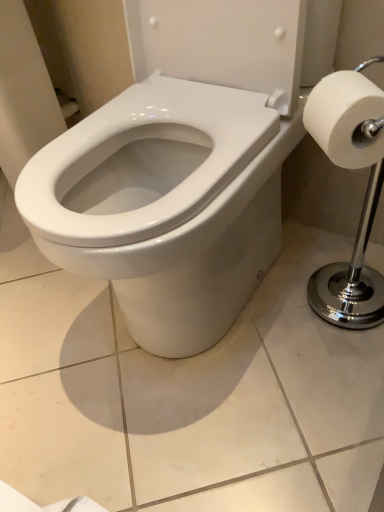
Question: From a real-world perspective, is white matte toilet paper at right physically below white glossy bidet at center?

Choices:
 (A) no
 (B) yes

Answer: (A)

Question: Is white matte toilet paper at right oriented towards white glossy bidet at center?

Choices:
 (A) no
 (B) yes

Answer: (B)

Question: Is white matte toilet paper at right outside white glossy bidet at center?

Choices:
 (A) yes
 (B) no

Answer: (A)

Question: Is white matte toilet paper at right not close to white glossy bidet at center?

Choices:
 (A) no
 (B) yes

Answer: (A)

Question: Is white matte toilet paper at right at the right side of white glossy bidet at center?

Choices:
 (A) no
 (B) yes

Answer: (B)

Question: Is white matte toilet paper at right smaller than white glossy bidet at center?

Choices:
 (A) yes
 (B) no

Answer: (A)

Question: Is white glossy bidet at center to the left of white matte toilet paper at right from the viewer's perspective?

Choices:
 (A) no
 (B) yes

Answer: (B)

Question: Does white glossy bidet at center have a smaller size compared to white matte toilet paper at right?

Choices:
 (A) yes
 (B) no

Answer: (B)

Question: Is white glossy bidet at center touching white matte toilet paper at right?

Choices:
 (A) no
 (B) yes

Answer: (A)

Question: From a real-world perspective, does white glossy bidet at center sit lower than white matte toilet paper at right?

Choices:
 (A) no
 (B) yes

Answer: (B)

Question: Is white matte toilet paper at right inside white glossy bidet at center?

Choices:
 (A) no
 (B) yes

Answer: (A)

Question: Does white glossy bidet at center come in front of white matte toilet paper at right?

Choices:
 (A) yes
 (B) no

Answer: (A)

Question: Is white matte toilet paper at right spatially inside white glossy bidet at center, or outside of it?

Choices:
 (A) inside
 (B) outside

Answer: (B)